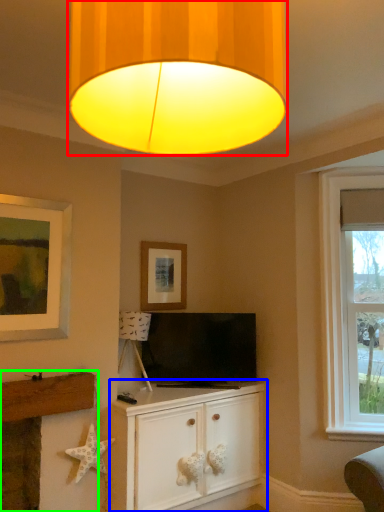
Question: Which object is positioned farthest from lamp (highlighted by a red box)? Select from cabinetry (highlighted by a blue box) and fireplace (highlighted by a green box).

Choices:
 (A) cabinetry
 (B) fireplace

Answer: (B)